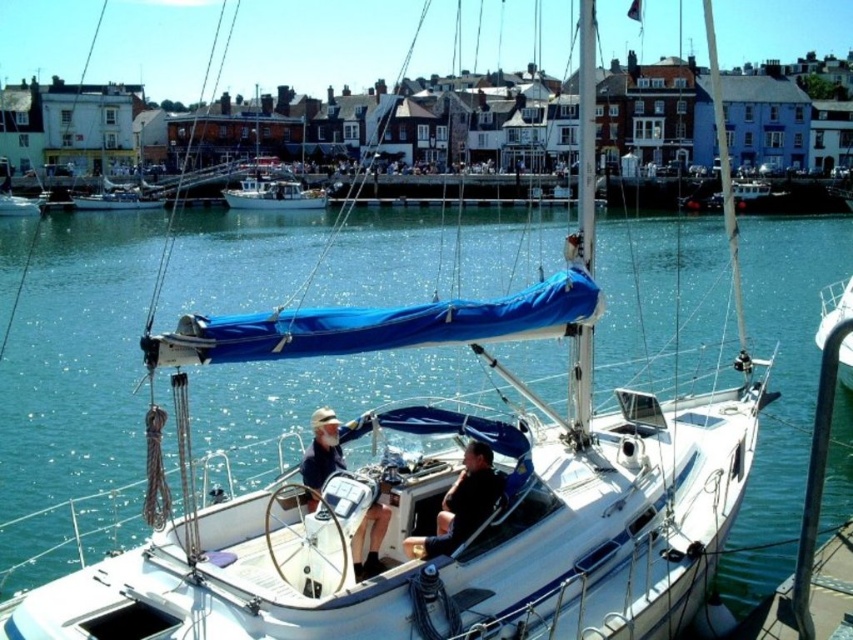
Question: Which of the following is the farthest from the observer?

Choices:
 (A) (230, 202)
 (B) (117, 200)
 (C) (18, 216)

Answer: (A)

Question: Which object is closer to the camera taking this photo?

Choices:
 (A) matte blue shirt at center
 (B) white matte boat at center

Answer: (A)

Question: Does white glossy sailboat at lower right have a smaller size compared to white matte sailboat at center?

Choices:
 (A) yes
 (B) no

Answer: (B)

Question: Is white matte boat at center to the left of white glossy sailboat at center from the viewer's perspective?

Choices:
 (A) yes
 (B) no

Answer: (B)

Question: Which of the following is the closest to the observer?

Choices:
 (A) (828, 483)
 (B) (247, 188)

Answer: (A)

Question: Is matte blue shirt at center thinner than white matte boat at center?

Choices:
 (A) no
 (B) yes

Answer: (B)